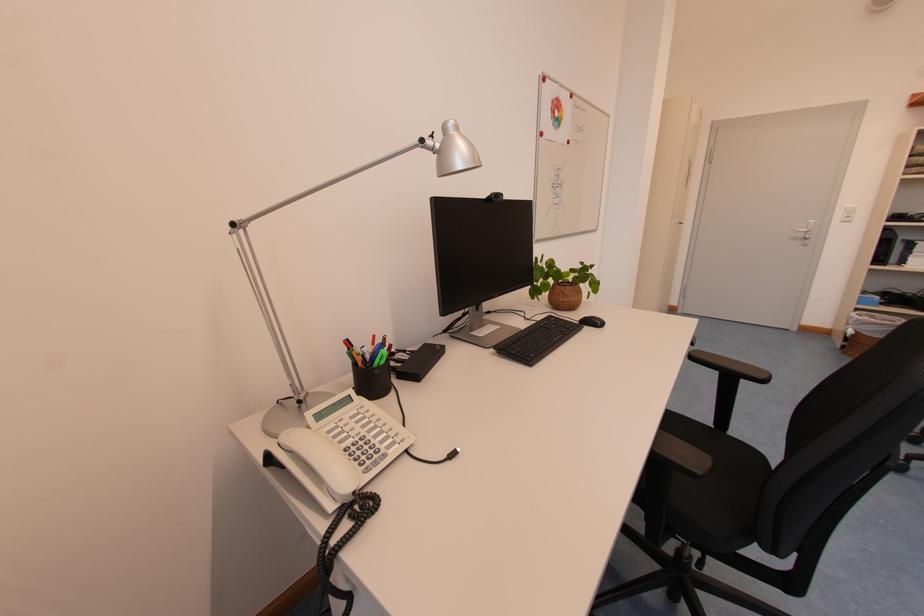
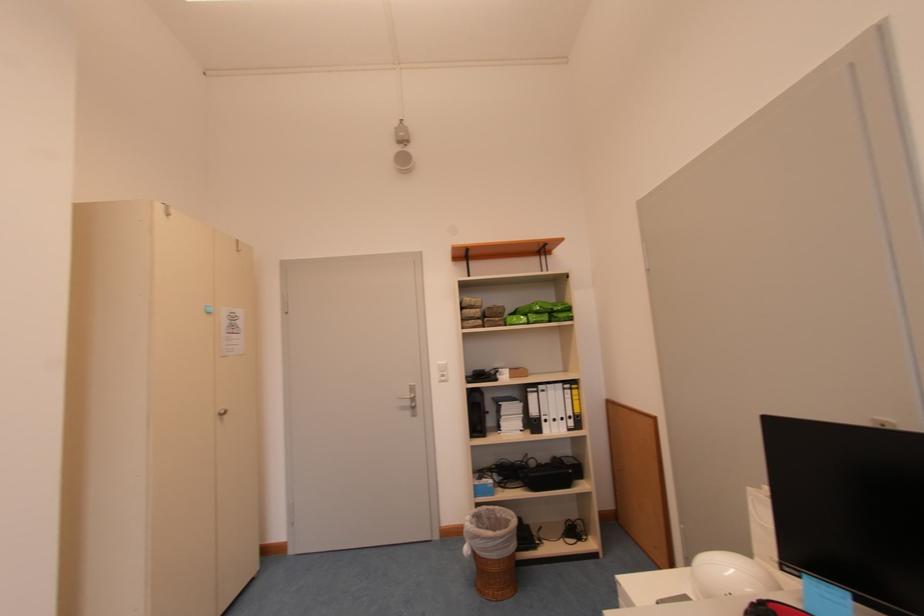
Locate, in the second image, the point that corresponds to pixel 808 238 in the first image.

(415, 406)